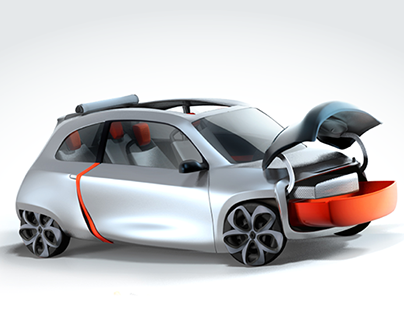
The width and height of the screenshot is (404, 316). Identify the location of orange headrest. (75, 139), (112, 132), (192, 112), (140, 131).